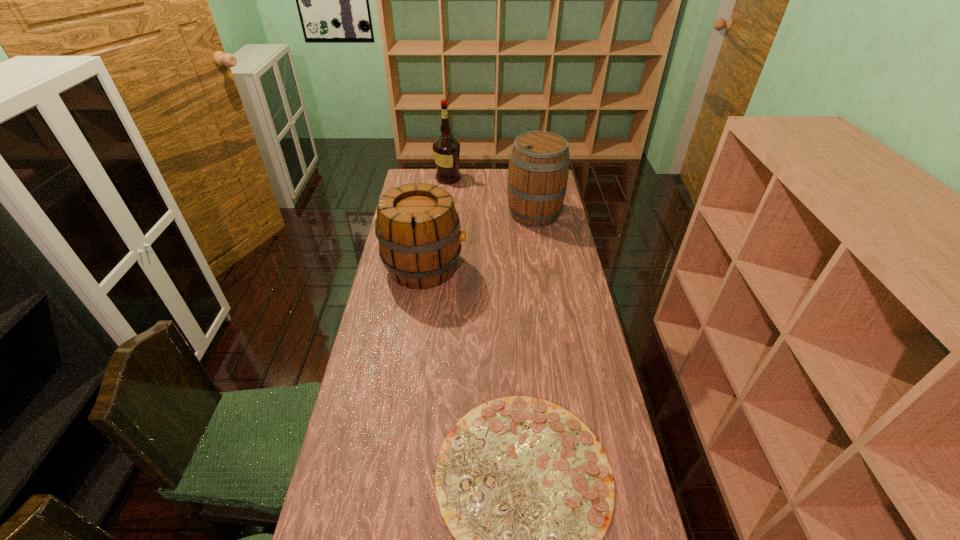
You are a GUI agent. You are given a task and a screenshot of the screen. Output one action in this format:
    pyautogui.click(x=<x>, y=<y>)
    Task: Click on the alcohol
    
    Given the screenshot: What is the action you would take?
    pyautogui.click(x=446, y=149)

Identify the location of the second farthest object. This screenshot has width=960, height=540. (538, 170).

This screenshot has width=960, height=540. In order to click on the farther cider in this screenshot , I will do `click(538, 170)`.

The image size is (960, 540). In order to click on the left cider in this screenshot , I will do `click(418, 229)`.

I want to click on the second shortest object, so click(x=418, y=229).

I want to click on free space located on the label of the alcohol, so click(x=496, y=178).

You are a GUI agent. You are given a task and a screenshot of the screen. Output one action in this format:
    pyautogui.click(x=<x>, y=<y>)
    Task: Click on the vacant area situated 0.250m on the back of the farther cider
    
    Given the screenshot: What is the action you would take?
    pos(528,173)

Image resolution: width=960 pixels, height=540 pixels. I want to click on vacant space situated on the side of the second shortest object where the spigot is located, so click(x=557, y=267).

The image size is (960, 540). I want to click on object that is at the far edge, so click(446, 149).

Locate an element on the screen. This screenshot has width=960, height=540. alcohol at the left edge is located at coordinates (446, 149).